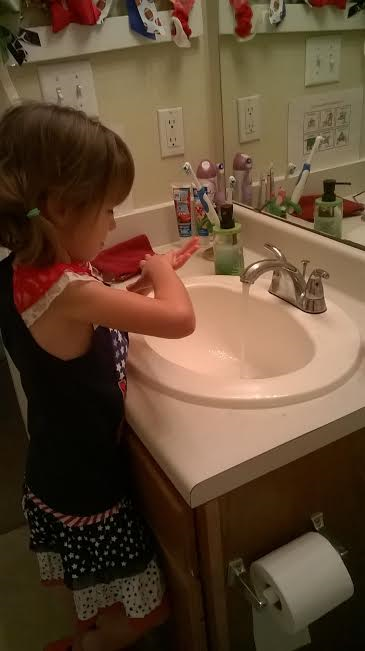
Locate an element on the screen. This screenshot has height=651, width=365. mirror is located at coordinates (351, 150).